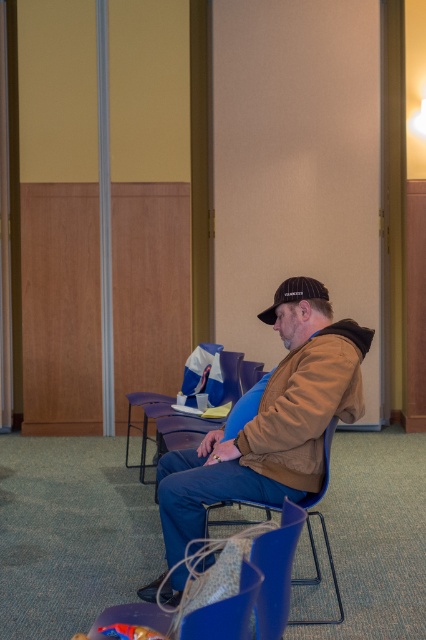
You are a tailor who needs to measure the brown suede jacket at center and the black matte baseball cap at center for alterations. Which item should you measure first if you want to start with the one closer to your eye level?

The black matte baseball cap at center is closer to your eye level since it is located above the brown suede jacket at center, so you should measure it first.

You are a person who wants to sit down in the waiting area. You see the blue plastic chair at center and the black matte baseball cap at center. Which object is bigger and can you sit on it?

The blue plastic chair at center is larger than the black matte baseball cap at center, so you can sit on the blue plastic chair at center.